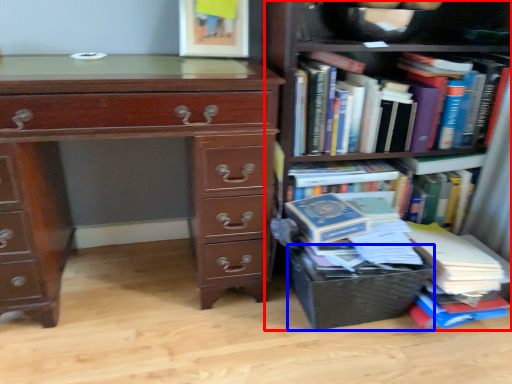
Question: Which of the following is the farthest to the observer, bookcase (highlighted by a red box) or crate (highlighted by a blue box)?

Choices:
 (A) bookcase
 (B) crate

Answer: (B)